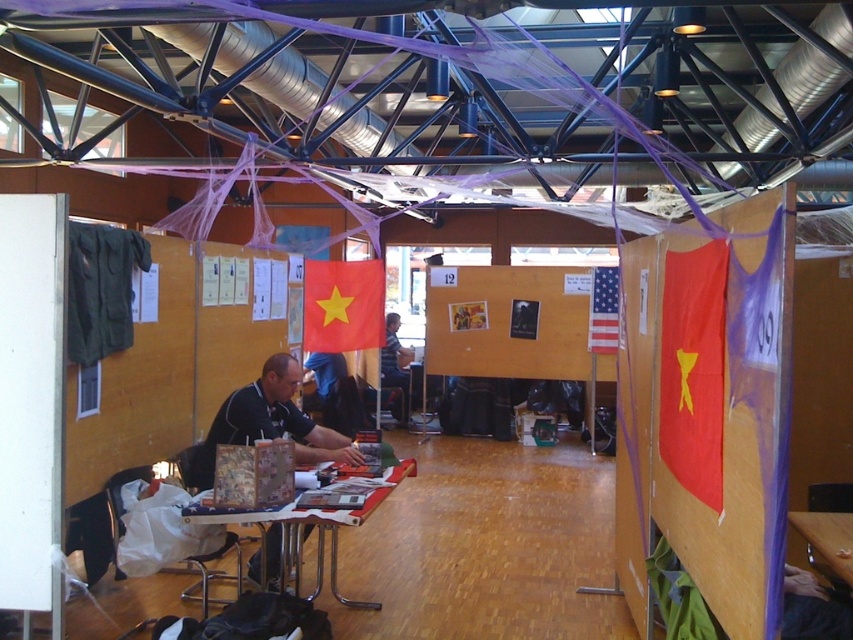
You are an event organizer arranging a photo shoot at the stall. You want to ensure the black matte shirt at center and the yellowmatteflag at center are both visible in the photo. Based on their positions, which object should be closer to the camera to achieve this?

The black matte shirt at center is in front of the yellowmatteflag at center, so to have both visible, the camera should be positioned so that the black matte shirt at center is closer to the camera while keeping the yellowmatteflag at center slightly behind but still in frame.

You are standing at the entrance of the exhibition hall and see a point marked at coordinates (718,419). According to the provided image, where is this point located?

The point is located on the matte red flag at center.